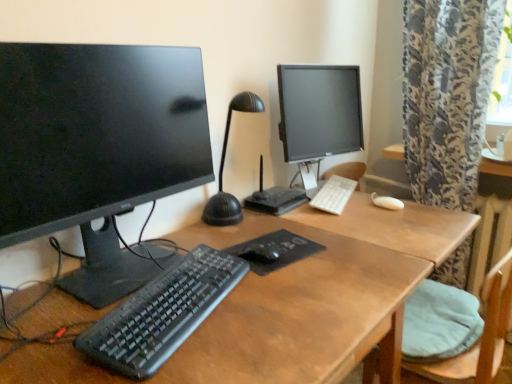
Question: Does white plastic keyboard at center, which appears as the 1th computer keyboard when viewed from the back, have a greater width compared to matte black monitor at center, marked as the second computer monitor in a front-to-back arrangement?

Choices:
 (A) yes
 (B) no

Answer: (B)

Question: Would you say white plastic keyboard at center, which appears as the 2th computer keyboard when viewed from the left, is outside matte black monitor at center, which is the 1th computer monitor from right to left?

Choices:
 (A) yes
 (B) no

Answer: (B)

Question: Is white plastic keyboard at center, placed as the 2th computer keyboard when sorted from bottom to top, closer to the viewer compared to matte black monitor at center, marked as the second computer monitor in a front-to-back arrangement?

Choices:
 (A) yes
 (B) no

Answer: (B)

Question: Would you say white plastic keyboard at center, which appears as the 2th computer keyboard when viewed from the left, contains matte black monitor at center, marked as the second computer monitor in a front-to-back arrangement?

Choices:
 (A) yes
 (B) no

Answer: (B)

Question: Does white plastic keyboard at center, which appears as the 2th computer keyboard when viewed from the left, come behind matte black monitor at center, which is counted as the 2th computer monitor, starting from the left?

Choices:
 (A) no
 (B) yes

Answer: (B)

Question: Considering the relative positions of matte black monitor at left, the first computer monitor when ordered from left to right, and black textured mousepad at center in the image provided, is matte black monitor at left, the first computer monitor when ordered from left to right, to the left or to the right of black textured mousepad at center?

Choices:
 (A) right
 (B) left

Answer: (B)

Question: In the image, is matte black monitor at left, which is the 1th computer monitor from front to back, positioned in front of or behind black textured mousepad at center?

Choices:
 (A) behind
 (B) front

Answer: (B)

Question: Considering the positions of matte black monitor at left, which is the 1th computer monitor from front to back, and black textured mousepad at center in the image, is matte black monitor at left, which is the 1th computer monitor from front to back, bigger or smaller than black textured mousepad at center?

Choices:
 (A) big
 (B) small

Answer: (A)

Question: In terms of width, does matte black monitor at left, marked as the second computer monitor in a right-to-left arrangement, look wider or thinner when compared to black textured mousepad at center?

Choices:
 (A) thin
 (B) wide

Answer: (B)

Question: Considering the positions of point (473, 375) and point (304, 319), is point (473, 375) closer or farther from the camera than point (304, 319)?

Choices:
 (A) farther
 (B) closer

Answer: (A)

Question: From the image's perspective, is light blue fabric cushion at lower right above or below wooden desk at center?

Choices:
 (A) below
 (B) above

Answer: (B)

Question: From a real-world perspective, relative to wooden desk at center, is light blue fabric cushion at lower right vertically above or below?

Choices:
 (A) below
 (B) above

Answer: (B)

Question: Considering their positions, is light blue fabric cushion at lower right located in front of or behind wooden desk at center?

Choices:
 (A) behind
 (B) front

Answer: (A)

Question: From their relative heights in the image, would you say matte black monitor at left, the first computer monitor when ordered from left to right, is taller or shorter than wooden desk at center?

Choices:
 (A) tall
 (B) short

Answer: (B)

Question: From a real-world perspective, is matte black monitor at left, marked as the second computer monitor in a right-to-left arrangement, above or below wooden desk at center?

Choices:
 (A) above
 (B) below

Answer: (A)